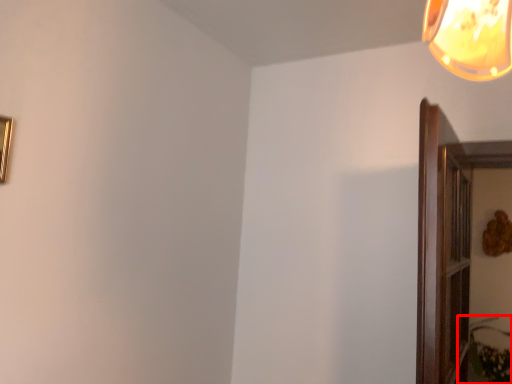
Question: From the image, what is the correct spatial relationship of plant (annotated by the red box) in relation to picture frame?

Choices:
 (A) left
 (B) right

Answer: (B)